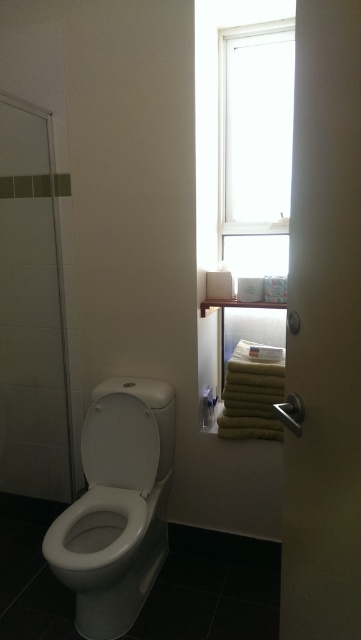
From the picture: Who is more distant from viewer, (284, 490) or (167, 445)?

Point (167, 445)

Who is shorter, transparent glass door at center or white glossy toilet at lower left?

white glossy toilet at lower left

Who is more forward, [315,314] or [163,481]?

Positioned in front is point [315,314].

Locate an element on the screen. The image size is (361, 640). transparent glass door at center is located at coordinates (324, 330).

Between white glossy toilet lid at center and brushed metal shower at lower right, which one is positioned higher?

brushed metal shower at lower right is higher up.

Is the position of white glossy toilet lid at center less distant than that of brushed metal shower at lower right?

No, white glossy toilet lid at center is further to the viewer.

You are a GUI agent. You are given a task and a screenshot of the screen. Output one action in this format:
    pyautogui.click(x=<x>, y=<y>)
    Task: Click on the white glossy toilet lid at center
    The image size is (361, 640).
    Given the screenshot: What is the action you would take?
    pyautogui.click(x=119, y=444)

Locate an element on the screen. The image size is (361, 640). white glossy toilet lid at center is located at coordinates point(119,444).

Measure the distance between white glossy toilet at lower left and camera.

white glossy toilet at lower left and camera are 1.64 meters apart from each other.

Is white glossy toilet at lower left closer to the viewer compared to transparent glass window at upper center?

Yes, it is.

Between point (81, 515) and point (276, 241), which one is positioned in front?

Point (81, 515)

At what (x,y) coordinates should I click in order to perform the action: click on white glossy toilet at lower left. Please return your answer as a coordinate pair (x, y). This screenshot has height=640, width=361. Looking at the image, I should click on (116, 506).